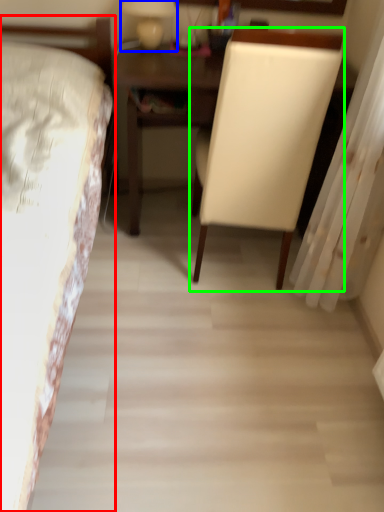
Question: Based on their relative distances, which object is nearer to bed (highlighted by a red box)? Choose from bedside lamp (highlighted by a blue box) and chair (highlighted by a green box).

Choices:
 (A) bedside lamp
 (B) chair

Answer: (B)